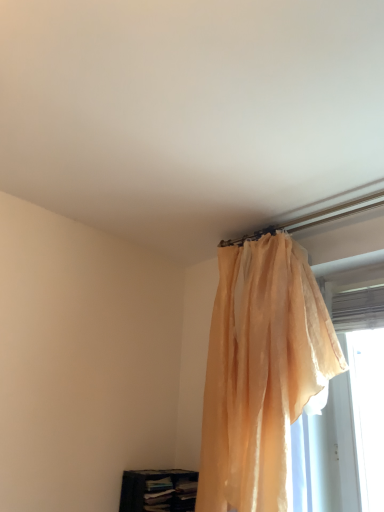
Question: Is translucent peach curtain at upper right inside or outside of dark blue fabric bookshelf at lower left?

Choices:
 (A) outside
 (B) inside

Answer: (A)

Question: Does point (218, 422) appear closer or farther from the camera than point (150, 488)?

Choices:
 (A) closer
 (B) farther

Answer: (A)

Question: Which is farther from the translucent fabric at right?

Choices:
 (A) dark blue fabric bookshelf at lower left
 (B) translucent peach curtain at upper right

Answer: (A)

Question: Based on their relative distances, which object is farther from the dark blue fabric bookshelf at lower left?

Choices:
 (A) translucent peach curtain at upper right
 (B) translucent fabric at right

Answer: (B)